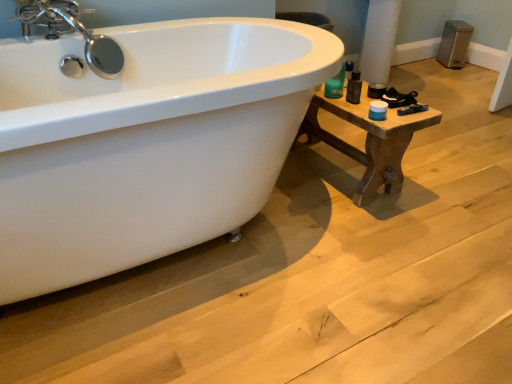
Locate an element on the screen. The height and width of the screenshot is (384, 512). free region under brown wooden table at right (from a real-world perspective) is located at coordinates (336, 164).